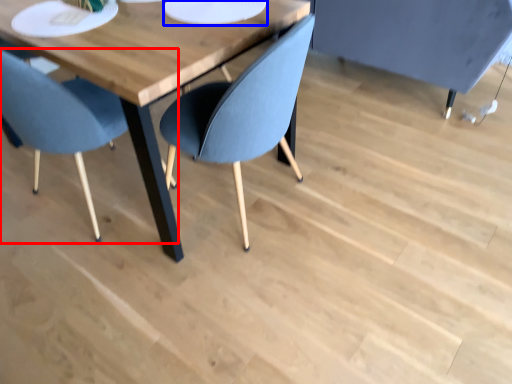
Question: Which object appears closest to the camera in this image, chair (highlighted by a red box) or paper plate (highlighted by a blue box)?

Choices:
 (A) chair
 (B) paper plate

Answer: (A)